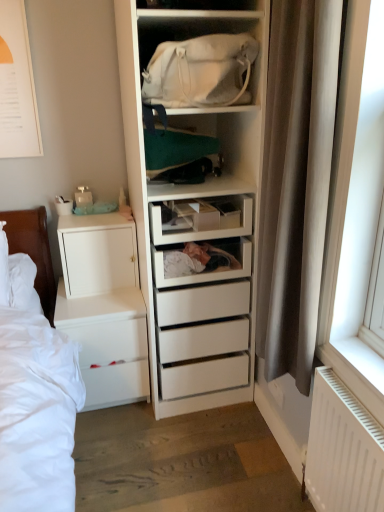
Find the location of `blank space above white matte cabinet at left (from a real-world perspective)`. blank space above white matte cabinet at left (from a real-world perspective) is located at coordinates (85, 215).